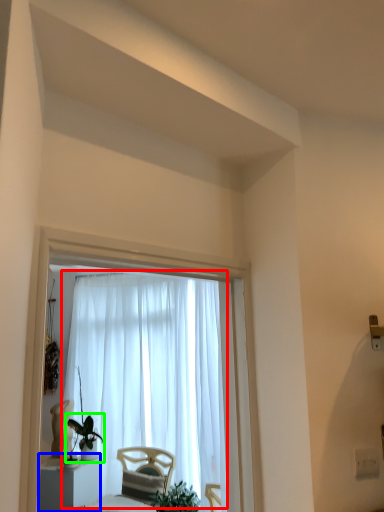
Question: Based on their relative distances, which object is farther from curtain (highlighted by a red box)? Choose from furniture (highlighted by a blue box) and houseplant (highlighted by a green box).

Choices:
 (A) furniture
 (B) houseplant

Answer: (A)